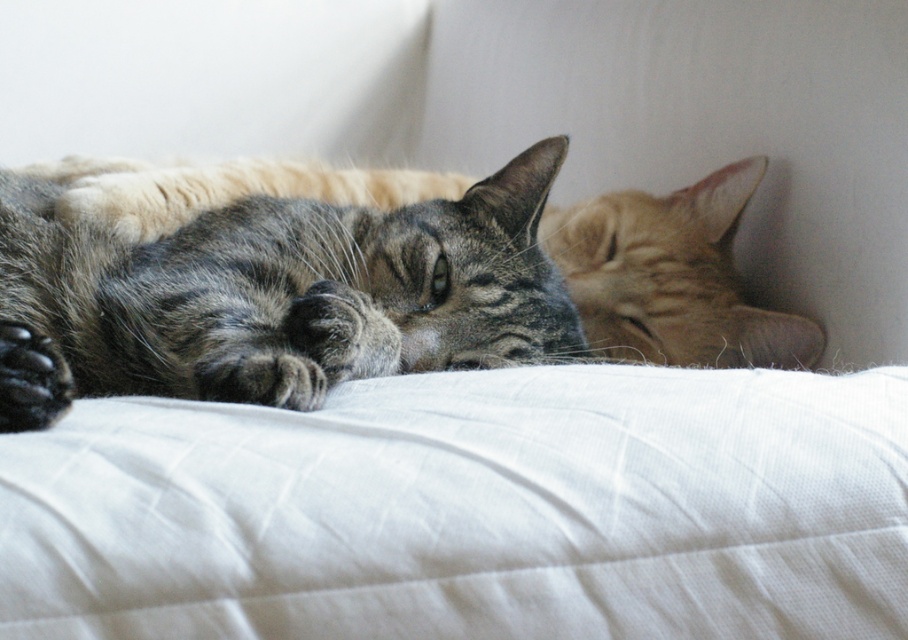
Is white quilted pillow at center to the left of black fur paw at lower left from the viewer's perspective?

In fact, white quilted pillow at center is to the right of black fur paw at lower left.

Who is shorter, white quilted pillow at center or black fur paw at lower left?

black fur paw at lower left is shorter.

Identify the location of white quilted pillow at center. (470, 509).

Is tabby fur cat at center closer to camera compared to black fur paw at lower left?

No, tabby fur cat at center is further to the viewer.

How distant is tabby fur cat at center from black fur paw at lower left?

The distance of tabby fur cat at center from black fur paw at lower left is 12.24 inches.

You are a GUI agent. You are given a task and a screenshot of the screen. Output one action in this format:
    pyautogui.click(x=<x>, y=<y>)
    Task: Click on the tabby fur cat at center
    
    Given the screenshot: What is the action you would take?
    tap(293, 291)

Which is in front, point (446, 454) or point (248, 307)?

Point (446, 454) is in front.

Which of these two, white quilted pillow at center or tabby fur cat at center, stands taller?

Standing taller between the two is tabby fur cat at center.

Locate an element on the screen. white quilted pillow at center is located at coordinates (470, 509).